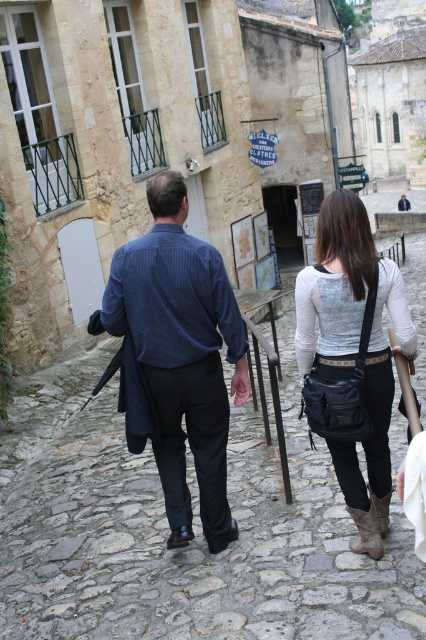
You are a photographer trying to capture a photo of the dark blue shirt at center and the matte black bag at center. From your current position, which object is closer to the left side of the frame?

The dark blue shirt at center is positioned on the left side of matte black bag at center, so it is closer to the left side of the frame.

You are a photographer trying to capture both the blue striped shirt at center and the matte black bag at center in a single frame. Given that your camera has a fixed focus that can only clearly capture objects within a 30 cm width, can you ensure both items are fully visible in the photo?

The blue striped shirt at center is narrower than the matte black bag at center. Since the camera can capture up to 30 cm width, and the total width of both items combined would depend on their individual widths. However, without knowing the exact widths, it is uncertain if they can both fit within the 30 cm limit. The answer requires more specific measurements.

You are a photographer trying to capture the dark blue shirt at center in the image. The camera is set to focus on the point at coordinates (176, 356). Will this point be on the dark blue shirt at center?

Yes, the point at coordinates (176, 356) indicates the dark blue shirt at center, so the focus will be on the dark blue shirt at center.